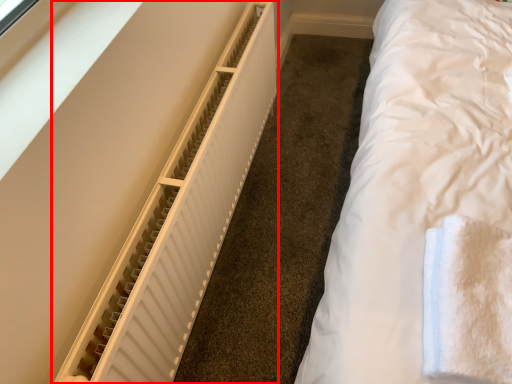
Question: Where is radiator (annotated by the red box) located in relation to cloth in the image?

Choices:
 (A) right
 (B) left

Answer: (B)